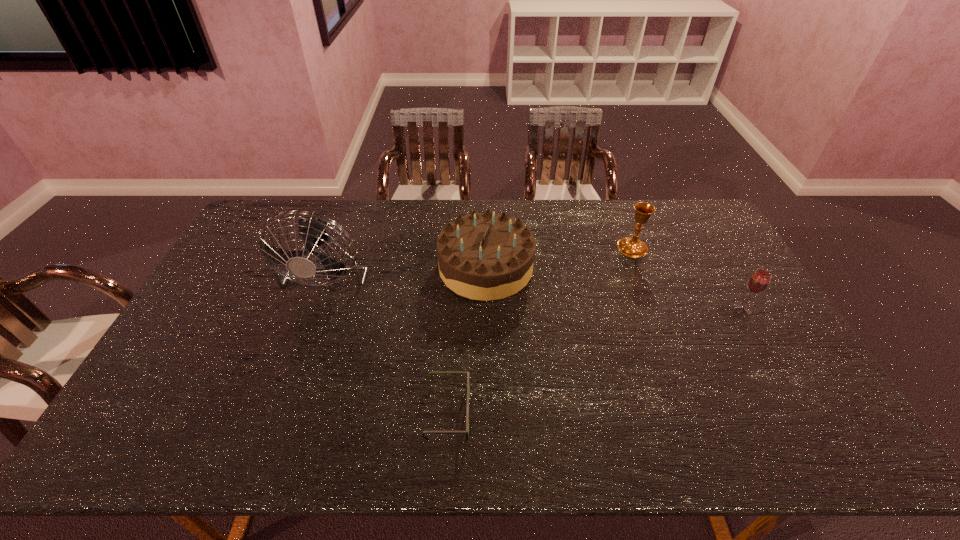
In the image, there is a desktop. Where is `free space at the near edge`? The height and width of the screenshot is (540, 960). free space at the near edge is located at coordinates (691, 428).

The width and height of the screenshot is (960, 540). What are the coordinates of `vacant area at the left edge of the desktop` in the screenshot? It's located at (228, 301).

I want to click on vacant space at the right edge, so click(x=728, y=333).

In the image, there is a desktop. Where is `vacant space at the far left corner`? The height and width of the screenshot is (540, 960). vacant space at the far left corner is located at coordinates (266, 234).

In the image, there is a desktop. Identify the location of vacant region at the far right corner. (719, 235).

You are a GUI agent. You are given a task and a screenshot of the screen. Output one action in this format:
    pyautogui.click(x=<x>, y=<y>)
    Task: Click on the free space at the near right corner of the desktop
    
    Given the screenshot: What is the action you would take?
    pyautogui.click(x=773, y=425)

Find the location of `empty space that is in between the chalice and the birthday cake`. empty space that is in between the chalice and the birthday cake is located at coordinates (559, 258).

The height and width of the screenshot is (540, 960). Identify the location of vacant space in between the birthday cake and the wineglass. (614, 288).

Identify the location of vacant area that lies between the rightmost object and the tallest object. (537, 287).

Locate an element on the screen. This screenshot has height=540, width=960. vacant region between the rightmost object and the chalice is located at coordinates (687, 279).